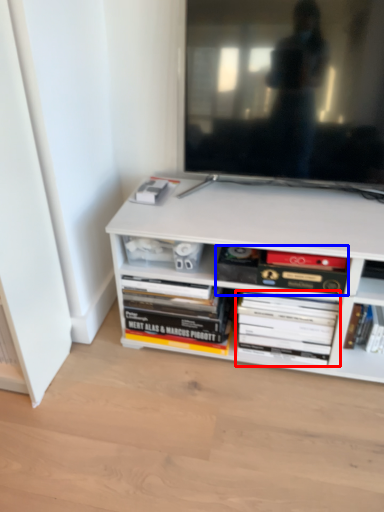
Question: Among these objects, which one is nearest to the camera, book (highlighted by a red box) or book (highlighted by a blue box)?

Choices:
 (A) book
 (B) book

Answer: (B)